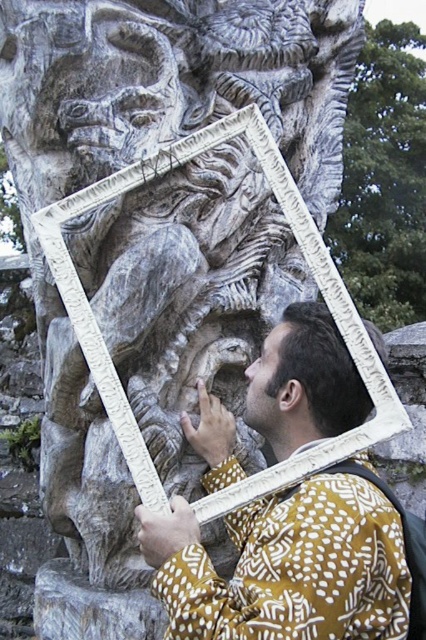
Question: Which point is farther to the camera?

Choices:
 (A) (417, 120)
 (B) (265, 408)
 (C) (154, 536)

Answer: (A)

Question: Considering the real-world distances, which object is closest to the green leafy tree at upper right?

Choices:
 (A) matte brown hair at lower right
 (B) yellow patterned shirt at center

Answer: (B)

Question: Which point is closer to the camera taking this photo?

Choices:
 (A) (367, 616)
 (B) (394, 273)
 (C) (247, 376)

Answer: (A)

Question: Where is yellow patterned shirt at center located in relation to green leafy tree at upper right in the image?

Choices:
 (A) right
 (B) left

Answer: (B)

Question: Does yellow patterned shirt at center have a larger size compared to green leafy tree at upper right?

Choices:
 (A) yes
 (B) no

Answer: (B)

Question: Can you confirm if yellow patterned shirt at center is wider than green leafy tree at upper right?

Choices:
 (A) no
 (B) yes

Answer: (A)